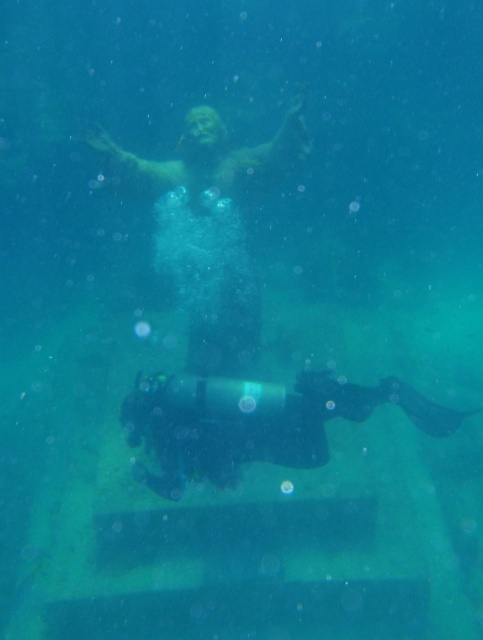
Question: Which object appears farthest from the camera in this image?

Choices:
 (A) black matte scuba diver at lower center
 (B) matte bronze statue at center

Answer: (B)

Question: Where is matte bronze statue at center located in relation to black matte scuba diver at lower center in the image?

Choices:
 (A) below
 (B) above

Answer: (B)

Question: Which object appears closest to the camera in this image?

Choices:
 (A) black matte scuba diver at lower center
 (B) matte bronze statue at center

Answer: (A)

Question: Is matte bronze statue at center closer to camera compared to black matte scuba diver at lower center?

Choices:
 (A) yes
 (B) no

Answer: (B)

Question: Which object is farther from the camera taking this photo?

Choices:
 (A) matte bronze statue at center
 (B) black matte scuba diver at lower center

Answer: (A)

Question: Can you confirm if matte bronze statue at center is positioned to the left of black matte scuba diver at lower center?

Choices:
 (A) yes
 (B) no

Answer: (A)